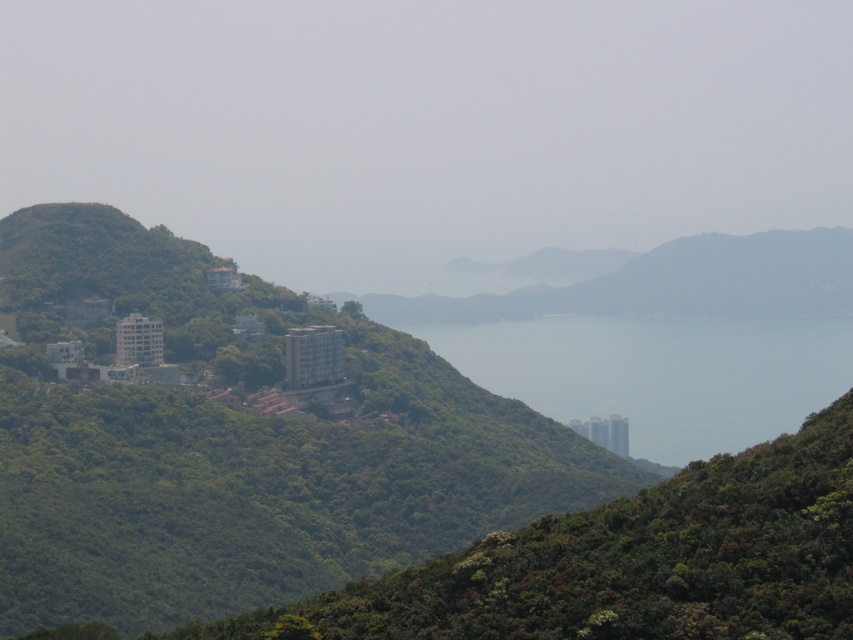
You are standing at the origin point in the image. Which direction should you move to reach the green leafy hillside at center?

The green leafy hillside at center is located at coordinates 0.694 on the x axis and 0.277 on the y axis. Since you are at the origin point, you should move towards the right and slightly upwards to reach it.

You are a hiker standing on the green leafy mountain at center and want to reach the transparent blue water at center. Which direction should you move in to get there?

The transparent blue water at center is to the right of green leafy mountain at center, so you should move to the right to reach it.